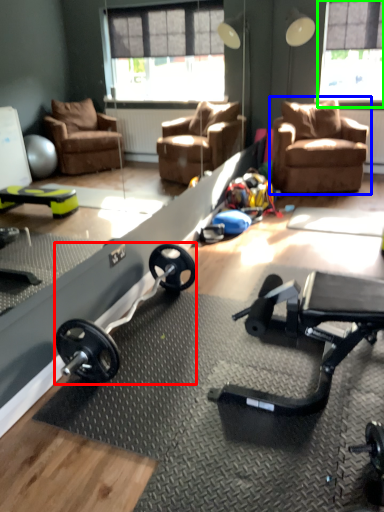
Question: Which object is the farthest from barbell (highlighted by a red box)? Choose among these: chair (highlighted by a blue box) or window screen (highlighted by a green box).

Choices:
 (A) chair
 (B) window screen

Answer: (B)